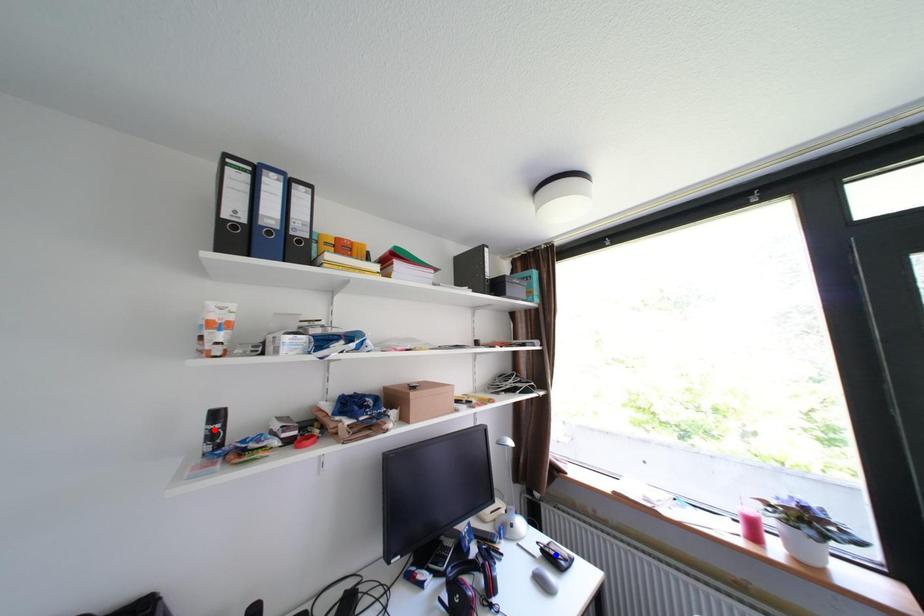
Question: Which of the two points in the image is closer to the camera?

Choices:
 (A) Blue point is closer.
 (B) Red point is closer.

Answer: (B)